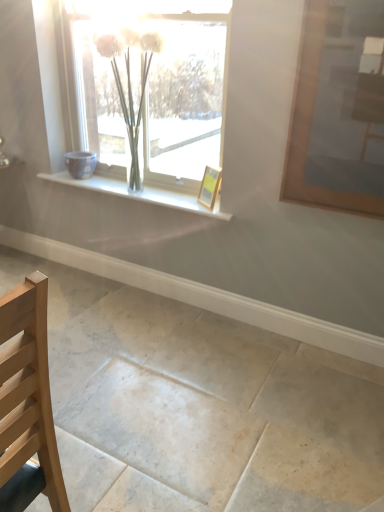
Question: Does light wood chair at lower left have a greater width compared to clear glass vase at upper center?

Choices:
 (A) no
 (B) yes

Answer: (B)

Question: From the image's perspective, is light wood chair at lower left located above clear glass vase at upper center?

Choices:
 (A) yes
 (B) no

Answer: (B)

Question: From a real-world perspective, is light wood chair at lower left under clear glass vase at upper center?

Choices:
 (A) yes
 (B) no

Answer: (A)

Question: Considering the relative sizes of light wood chair at lower left and clear glass vase at upper center in the image provided, is light wood chair at lower left taller than clear glass vase at upper center?

Choices:
 (A) yes
 (B) no

Answer: (A)

Question: Is clear glass vase at upper center inside light wood chair at lower left?

Choices:
 (A) yes
 (B) no

Answer: (B)

Question: From a real-world perspective, is white glossy window sill at center above or below clear glass vase at upper center?

Choices:
 (A) above
 (B) below

Answer: (B)

Question: From the image's perspective, is white glossy window sill at center above or below clear glass vase at upper center?

Choices:
 (A) below
 (B) above

Answer: (A)

Question: Do you think white glossy window sill at center is within clear glass vase at upper center, or outside of it?

Choices:
 (A) inside
 (B) outside

Answer: (B)

Question: Based on their positions, is white glossy window sill at center located to the left or right of clear glass vase at upper center?

Choices:
 (A) right
 (B) left

Answer: (B)

Question: Relative to wooden picture frame at upper right, the first picture frame viewed from the front, is white glossy window sill at center in front or behind?

Choices:
 (A) front
 (B) behind

Answer: (B)

Question: In the image, is white glossy window sill at center on the left side or the right side of wooden picture frame at upper right, which ranks as the 2th picture frame in back-to-front order?

Choices:
 (A) right
 (B) left

Answer: (B)

Question: Looking at their shapes, would you say white glossy window sill at center is wider or thinner than wooden picture frame at upper right, marked as the 1th picture frame in a right-to-left arrangement?

Choices:
 (A) wide
 (B) thin

Answer: (A)

Question: From a real-world perspective, is white glossy window sill at center physically located above or below wooden picture frame at upper right, the second picture frame from the left?

Choices:
 (A) below
 (B) above

Answer: (A)

Question: Would you say wooden picture frame at upper right, the second picture frame from the left, is to the left or to the right of wooden picture frame at center, the second picture frame positioned from the front, in the picture?

Choices:
 (A) right
 (B) left

Answer: (A)

Question: From the image's perspective, is wooden picture frame at upper right, marked as the 1th picture frame in a right-to-left arrangement, above or below wooden picture frame at center, which ranks as the second picture frame in right-to-left order?

Choices:
 (A) above
 (B) below

Answer: (A)